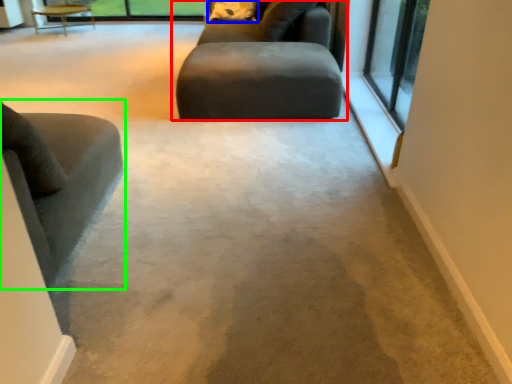
Question: Which object is the closest to the studio couch (highlighted by a red box)? Choose among these: pillow (highlighted by a blue box) or chair (highlighted by a green box).

Choices:
 (A) pillow
 (B) chair

Answer: (A)